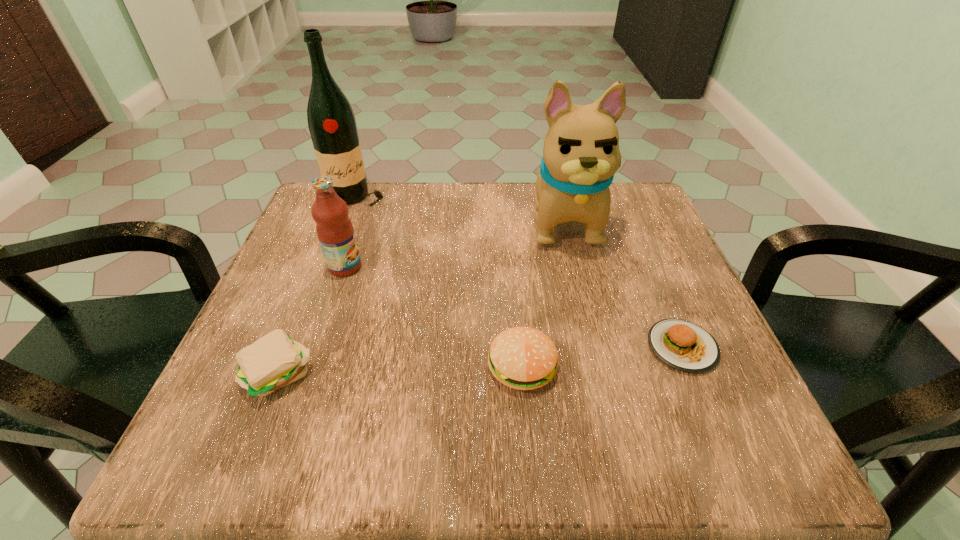
Point out which object is positioned as the fifth nearest to the rightmost object. Please provide its 2D coordinates. Your answer should be formatted as a tuple, i.e. [(x, y)], where the tuple contains the x and y coordinates of a point satisfying the conditions above.

[(331, 121)]

Identify which food is the nearest to the rightmost food. Please provide its 2D coordinates. Your answer should be formatted as a tuple, i.e. [(x, y)], where the tuple contains the x and y coordinates of a point satisfying the conditions above.

[(523, 358)]

Select which food is the second closest to the wine bottle. Please provide its 2D coordinates. Your answer should be formatted as a tuple, i.e. [(x, y)], where the tuple contains the x and y coordinates of a point satisfying the conditions above.

[(523, 358)]

At what (x,y) coordinates should I click in order to perform the action: click on vacant point that satisfies the following two spatial constraints: 1. on the face of the puppy; 2. on the front label of the third tallest object. Please return your answer as a coordinate pair (x, y). Looking at the image, I should click on (575, 267).

Find the location of a particular element. free space that satisfies the following two spatial constraints: 1. on the front label of the third tallest object; 2. on the right side of the second food from left to right is located at coordinates (312, 367).

This screenshot has height=540, width=960. Identify the location of free space that satisfies the following two spatial constraints: 1. on the back side of the shortest food; 2. on the front label of the fourth shortest object. (649, 267).